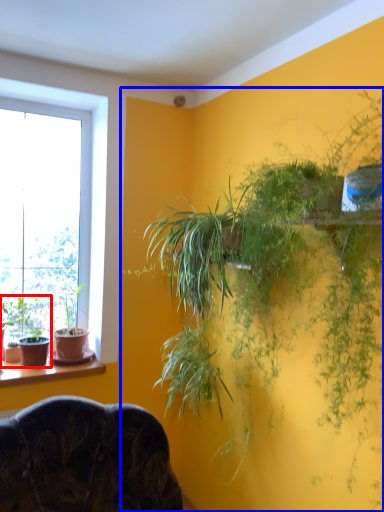
Question: Which of the following is the closest to the observer, houseplant (highlighted by a red box) or houseplant (highlighted by a blue box)?

Choices:
 (A) houseplant
 (B) houseplant

Answer: (B)